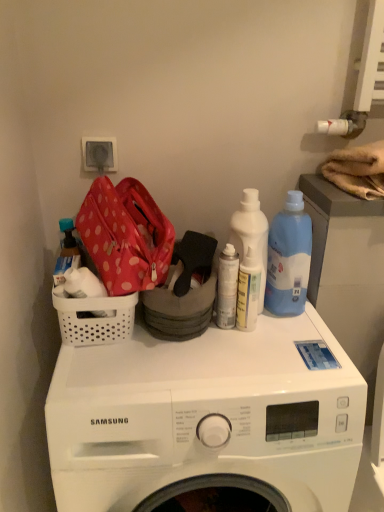
The width and height of the screenshot is (384, 512). I want to click on vacant area that is situated to the right of white matte spray can at center, the 2th bottle viewed from the left, so click(x=291, y=339).